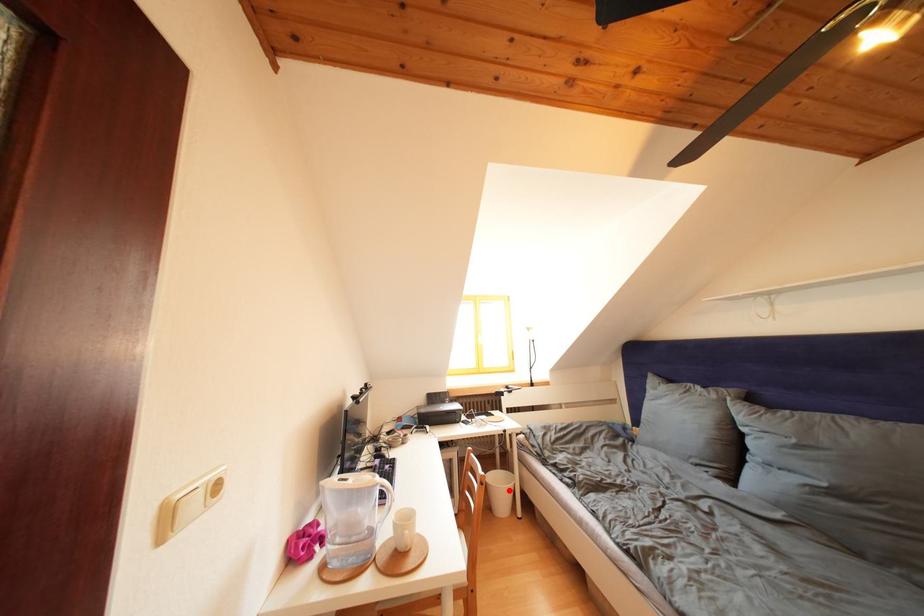
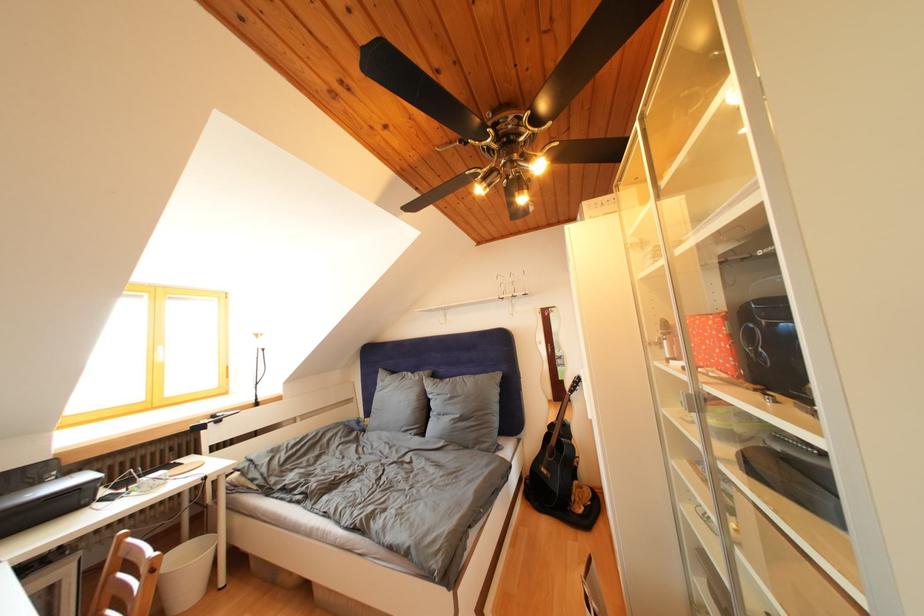
Where in the second image is the point corresponding to the highlighted location from the first image?

(198, 565)